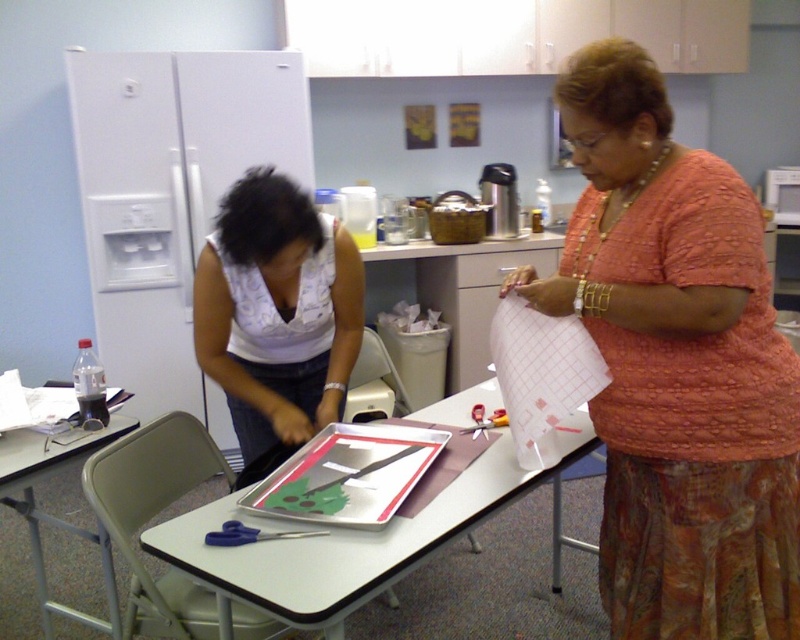
Question: Is matte orange blouse at center behind white printed shirt at center?

Choices:
 (A) yes
 (B) no

Answer: (B)

Question: Which point is farther to the camera?

Choices:
 (A) metallic scissors at center
 (B) metallic gray table at lower left

Answer: (A)

Question: Which object is the closest to the metallic scissors at center?

Choices:
 (A) metallic gray table at lower left
 (B) white plastic table at center
 (C) matte orange blouse at center
 (D) white printed shirt at center

Answer: (B)

Question: Is matte orange blouse at center positioned at the back of metallic scissors at center?

Choices:
 (A) yes
 (B) no

Answer: (B)

Question: Considering the relative positions of matte orange blouse at center and metallic gray table at lower left in the image provided, where is matte orange blouse at center located with respect to metallic gray table at lower left?

Choices:
 (A) left
 (B) right

Answer: (B)

Question: Which point is closer to the camera?

Choices:
 (A) pyautogui.click(x=222, y=212)
 (B) pyautogui.click(x=236, y=538)
 (C) pyautogui.click(x=588, y=364)

Answer: (B)